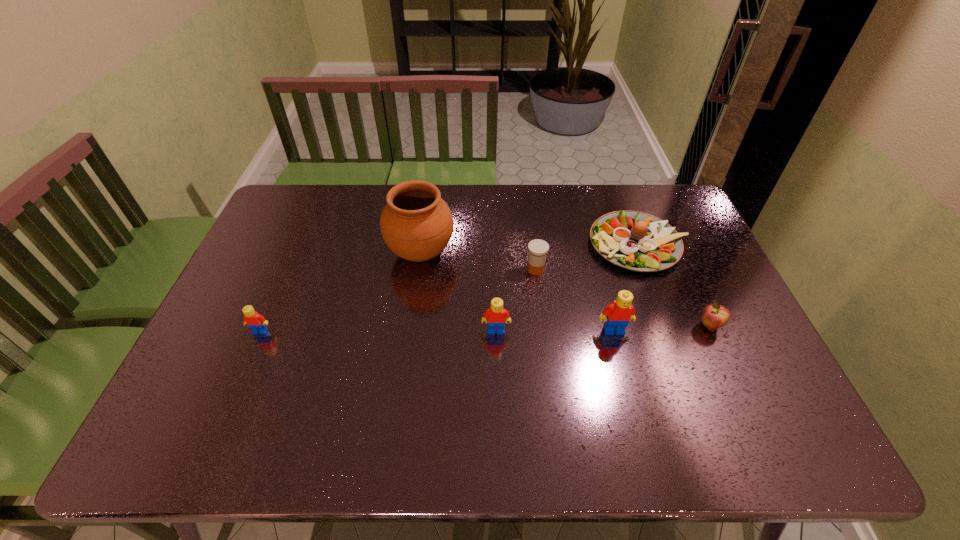
The width and height of the screenshot is (960, 540). I want to click on object present at the far edge, so pyautogui.click(x=637, y=241).

Locate an element on the screen. object present at the left edge is located at coordinates (256, 322).

What are the coordinates of `salad plate that is at the right edge` in the screenshot? It's located at [637, 241].

The height and width of the screenshot is (540, 960). Find the location of `apple present at the right edge`. apple present at the right edge is located at coordinates (714, 316).

This screenshot has width=960, height=540. I want to click on object that is at the far right corner, so click(x=637, y=241).

Image resolution: width=960 pixels, height=540 pixels. In the image, there is a desktop. Identify the location of vacant space at the far edge. (361, 215).

Identify the location of free space at the near edge of the desktop. The width and height of the screenshot is (960, 540). (555, 377).

In the image, there is a desktop. What are the coordinates of `free space at the right edge` in the screenshot? It's located at (756, 349).

Image resolution: width=960 pixels, height=540 pixels. Identify the location of free space at the far left corner. (286, 204).

The height and width of the screenshot is (540, 960). I want to click on free space at the far right corner of the desktop, so click(672, 201).